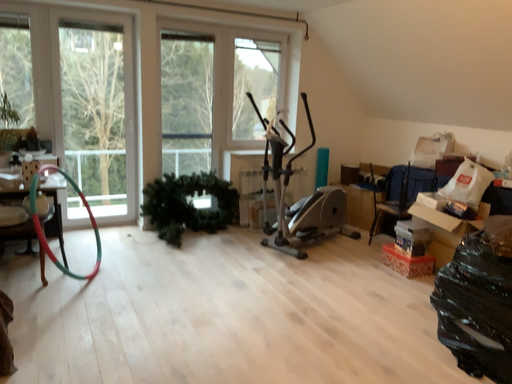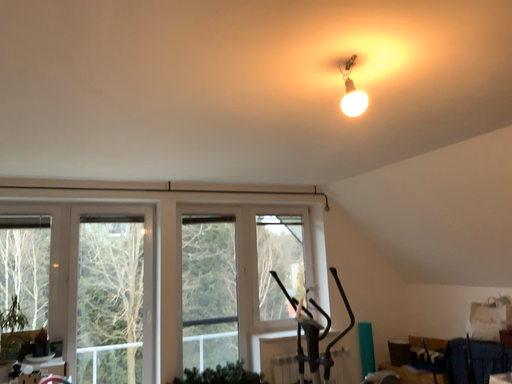
Question: Which way did the camera rotate in the video?

Choices:
 (A) rotated upward
 (B) rotated downward

Answer: (A)